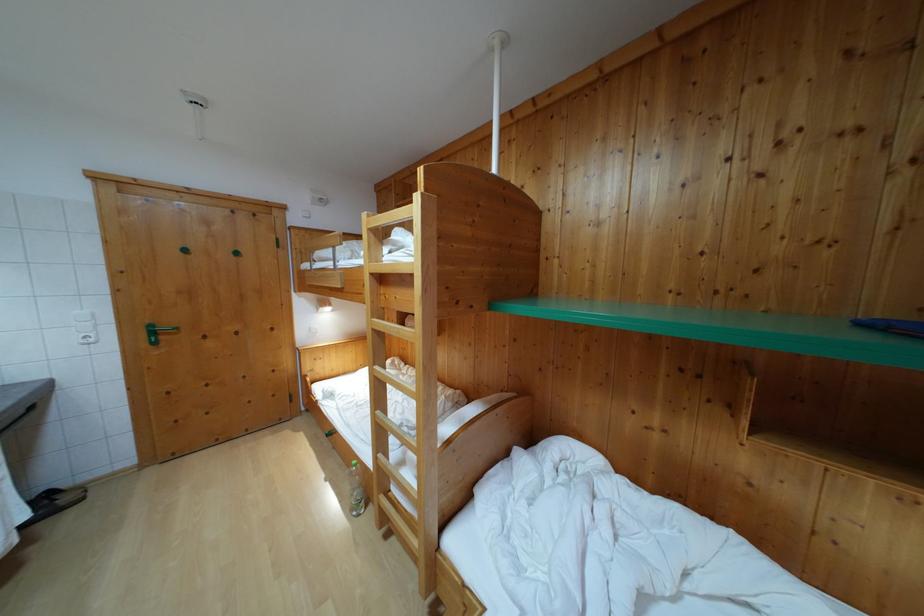
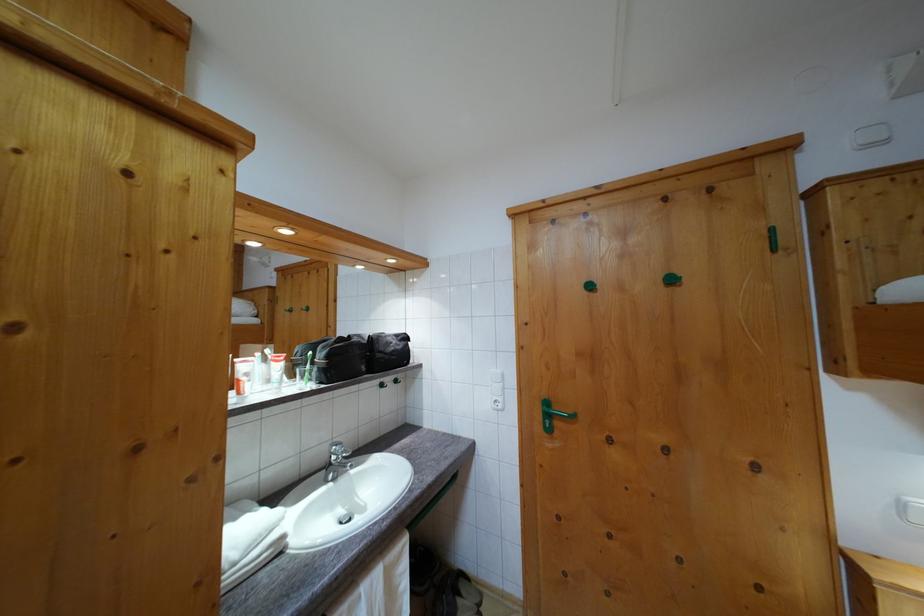
The point at [240,261] is marked in the first image. Where is the corresponding point in the second image?

(675, 286)